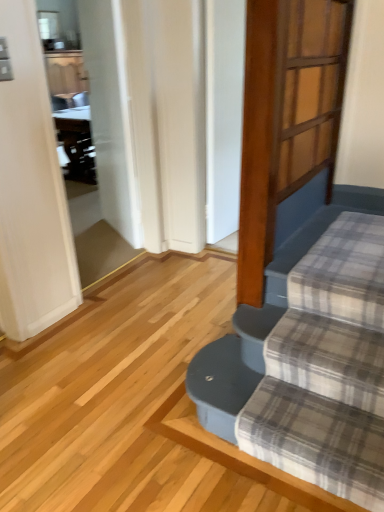
Question: Would you say wooden screen door at upper right, which is counted as the 2th screen door, starting from the back, is to the left or to the right of white glossy screen door at upper left, the 2th screen door in the front-to-back sequence, in the picture?

Choices:
 (A) right
 (B) left

Answer: (A)

Question: Based on their sizes in the image, would you say wooden screen door at upper right, which is counted as the 2th screen door, starting from the back, is bigger or smaller than white glossy screen door at upper left, placed as the 1th screen door when sorted from left to right?

Choices:
 (A) small
 (B) big

Answer: (A)

Question: Considering the real-world distances, which object is farthest from the wooden screen door at upper right, which is counted as the 2th screen door, starting from the back?

Choices:
 (A) white glossy screen door at upper left, placed as the 1th screen door when sorted from left to right
 (B) plaid fabric at lower right

Answer: (A)

Question: Which of these objects is positioned closest to the wooden screen door at upper right, acting as the 2th screen door starting from the left?

Choices:
 (A) plaid fabric at lower right
 (B) white glossy screen door at upper left, placed as the 1th screen door when sorted from left to right

Answer: (A)